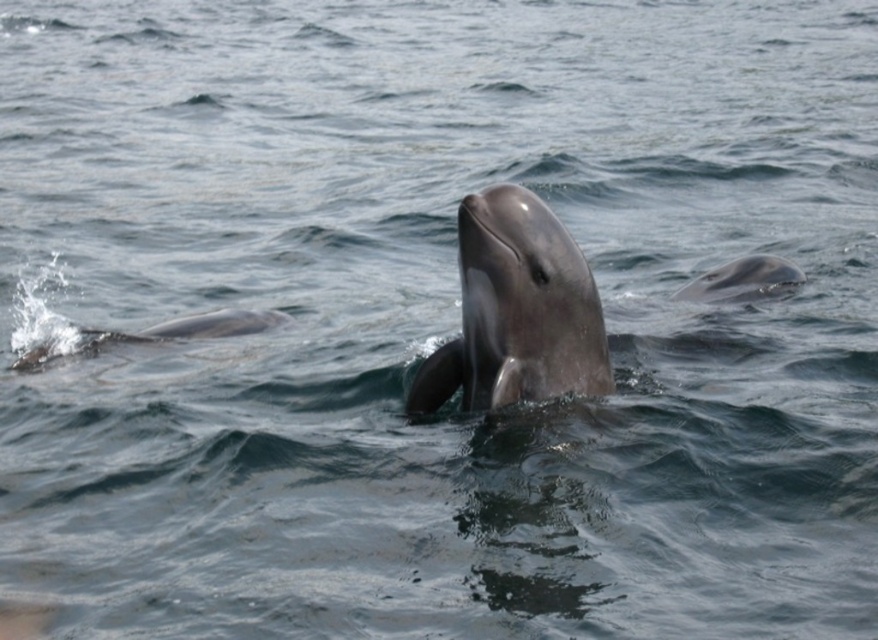
You are observing two points in the water where dolphins are swimming. The first point is at coordinates point (599, 323) and the second is at point (205, 316). Which point is nearer to you as you look at the scene?

Point (599, 323) is closer to the camera than point (205, 316), so the first point is nearer to you.